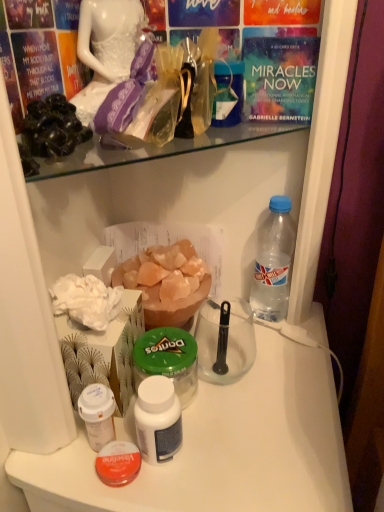
The image size is (384, 512). I want to click on free space above white plastic table at center (from a real-world perspective), so click(x=231, y=392).